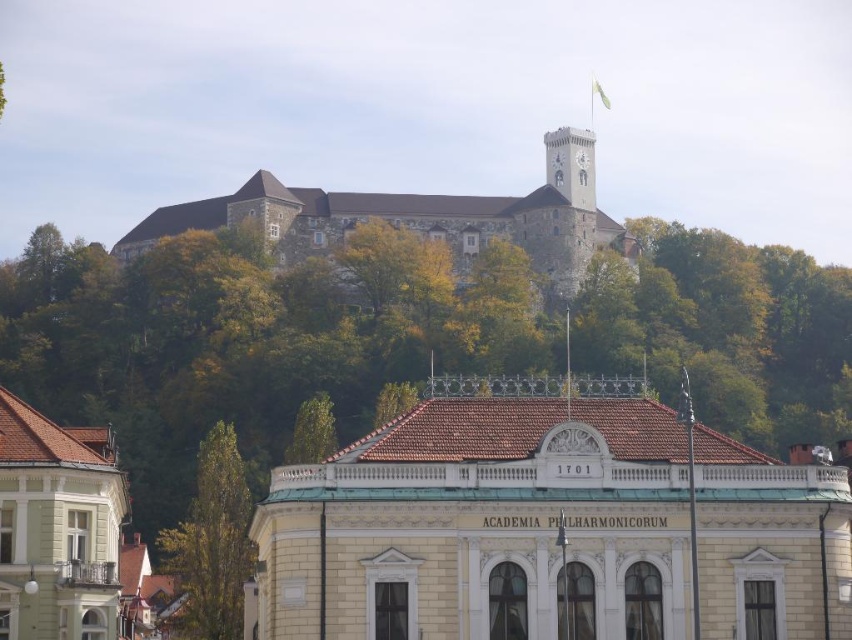
You are a tourist standing at the base of the hill where the green leafy tree at lower left is located. You want to take a photo of the brown stone castle at upper center without any obstructions. Considering the distance between them, can you estimate if you can clearly capture the entire castle in your photo without moving closer?

The brown stone castle at upper center and green leafy tree at lower left are 68.40 meters apart. Since you are at the base of the hill near the tree, the distance is sufficient to capture the entire castle in your photo without obstructions, provided there are no other intervening obstacles between you and the castle.

You are standing in the foreground of the image and want to take a photo of the brown stone castle at upper center. Based on its position, in which direction should you point your camera to capture it?

The brown stone castle at upper center is located at point (400, 225), so you should point your camera towards the upper center direction to capture it.

You are an architect analyzing the elevation of the castle. You notice the light gray stone clock tower at upper center and the green leafy tree at upper center. Which of these two is positioned higher in the scene?

The light gray stone clock tower at upper center is located above the green leafy tree at upper center, so it is positioned higher in the scene.